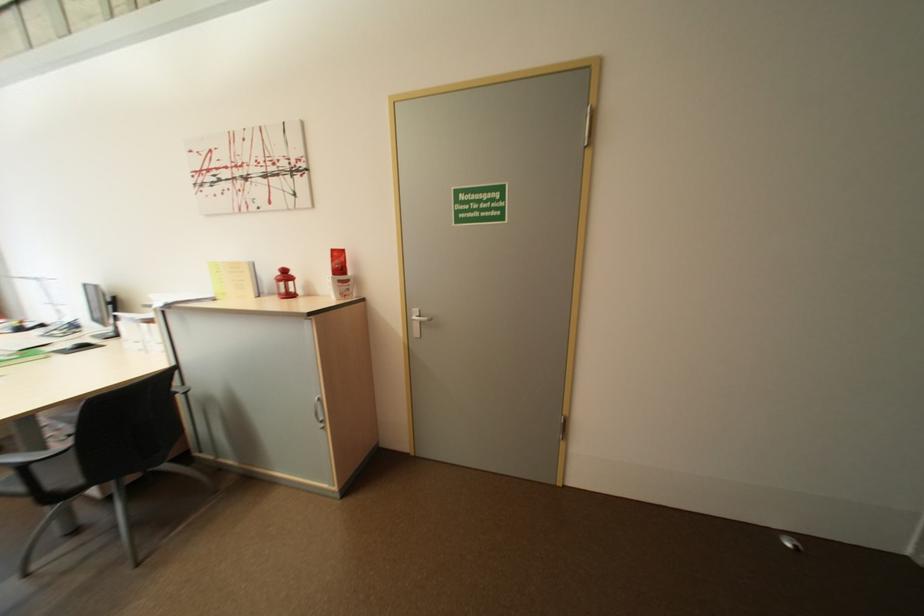
Describe the element at coordinates (285, 284) in the screenshot. I see `a small red lantern` at that location.